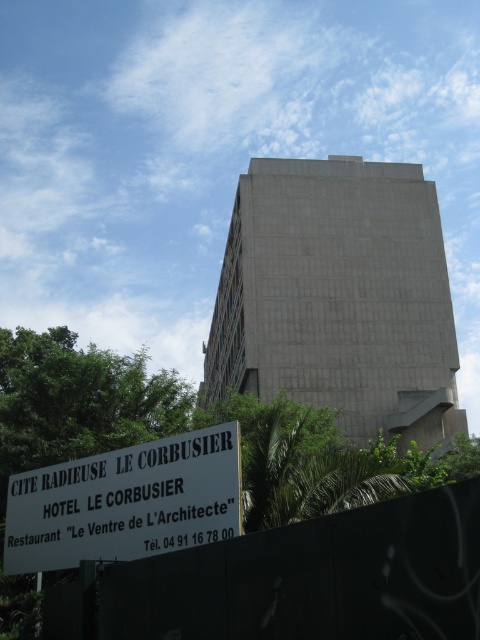
Which is behind, point (468, 577) or point (52, 502)?

Point (52, 502)

Looking at this image, which is more to the right, black matte fence at lower center or white plastic sign at lower left?

black matte fence at lower center

Is point (444, 612) positioned behind point (14, 481)?

No, (444, 612) is closer to viewer.

Identify the location of black matte fence at lower center. (312, 579).